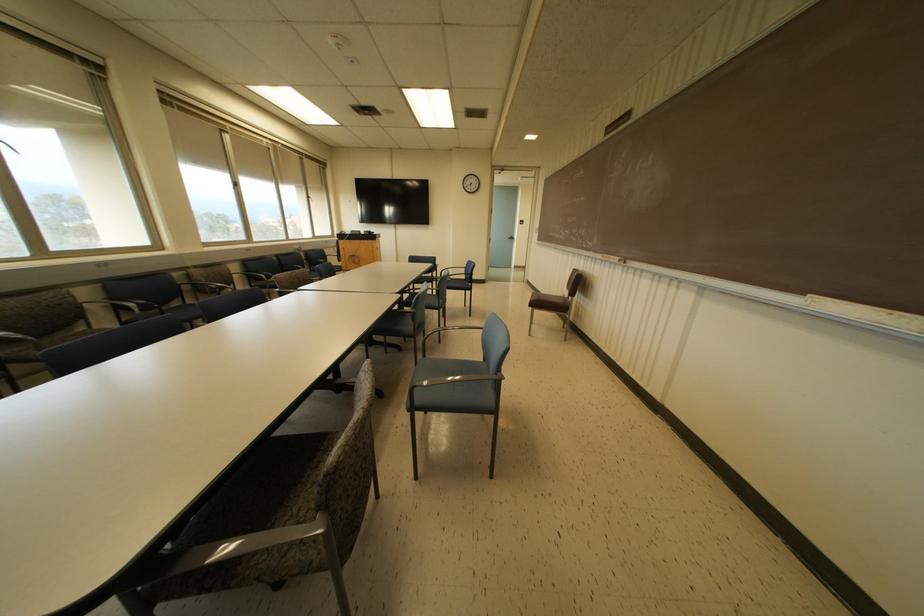
Locate an element on the screen. The image size is (924, 616). brown chair sitting surface is located at coordinates (548, 301).